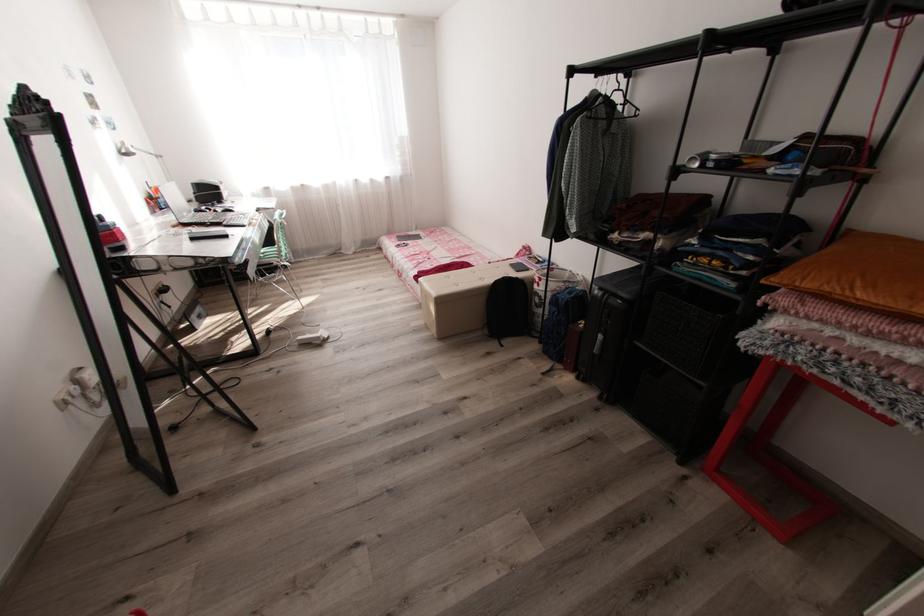
Describe the element at coordinates (862, 273) in the screenshot. I see `a orange pillow` at that location.